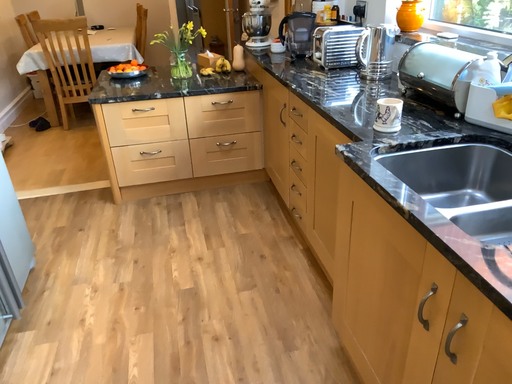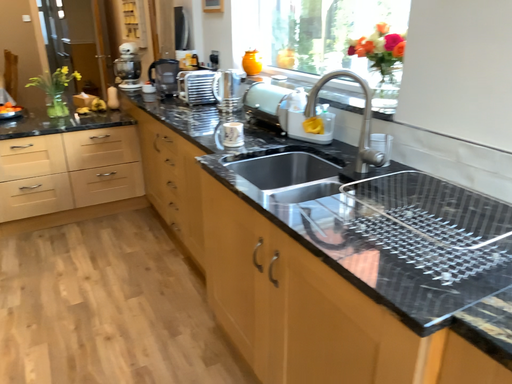
Question: Which way did the camera rotate in the video?

Choices:
 (A) rotated right
 (B) rotated left

Answer: (A)